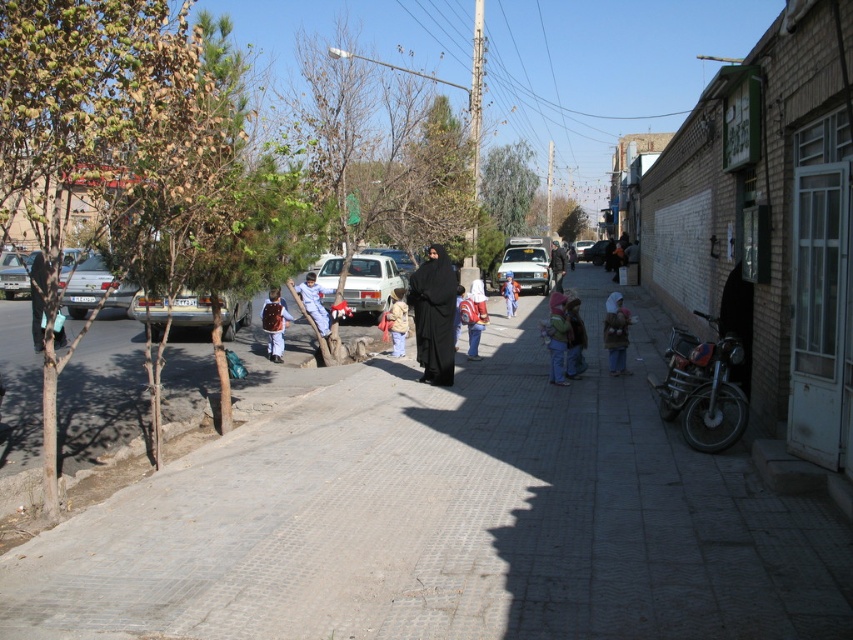
You are standing at the center of the street in the image. You see a point marked at coordinates (703,390). Which object does this point belong to?

The point at coordinates (703,390) is located on the dark metallic motorcycle at right.

You are a delivery person trying to park your motorcycle between the dark brown fabric child at center and the matte silver sedan at left. Is there enough space between them for your motorcycle?

The dark brown fabric child at center is narrower than the matte silver sedan at left, but the exact distance between them isn not specified. Without knowing the width of the motorcycle or the distance between the objects, it is impossible to determine if there is enough space.